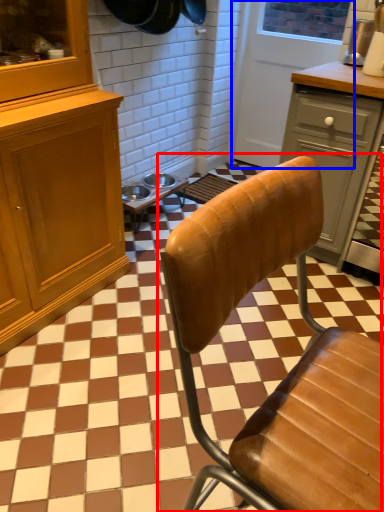
Question: Which of the following is the closest to the observer, chair (highlighted by a red box) or screen door (highlighted by a blue box)?

Choices:
 (A) chair
 (B) screen door

Answer: (A)